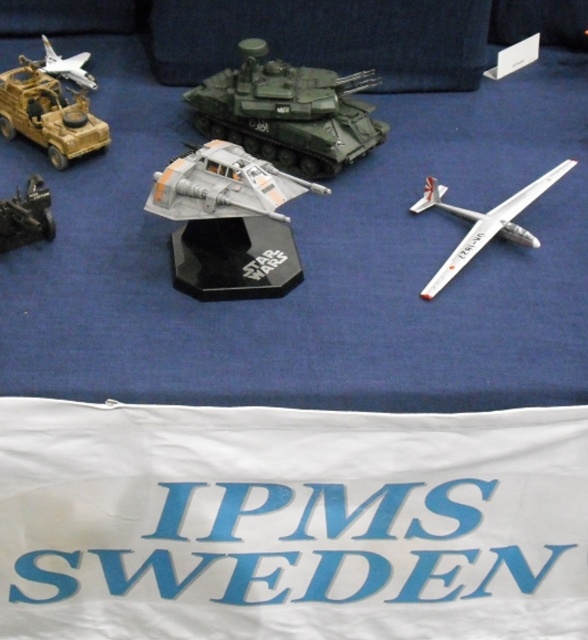
Can you confirm if white glossy airplane at upper right is smaller than white matte airplane at upper left?

No.

Can you confirm if white glossy airplane at upper right is wider than white matte airplane at upper left?

Yes, white glossy airplane at upper right is wider than white matte airplane at upper left.

Between point (540, 189) and point (81, 83), which one is positioned behind?

The point (81, 83) is behind.

Identify the location of white glossy airplane at upper right. (483, 221).

Is satin silver plastic starfighter at center bigger than white matte airplane at upper left?

Yes, satin silver plastic starfighter at center is bigger than white matte airplane at upper left.

Between satin silver plastic starfighter at center and white matte airplane at upper left, which one appears on the right side from the viewer's perspective?

satin silver plastic starfighter at center

At what (x,y) coordinates should I click in order to perform the action: click on satin silver plastic starfighter at center. Please return your answer as a coordinate pair (x, y). This screenshot has height=640, width=588. Looking at the image, I should click on (228, 221).

Is matte brown military vehicle at left thinner than white matte airplane at upper left?

In fact, matte brown military vehicle at left might be wider than white matte airplane at upper left.

Is matte brown military vehicle at left closer to the viewer compared to white matte airplane at upper left?

Yes, it is in front of white matte airplane at upper left.

The height and width of the screenshot is (640, 588). Find the location of `matte brown military vehicle at left`. matte brown military vehicle at left is located at coordinates (48, 115).